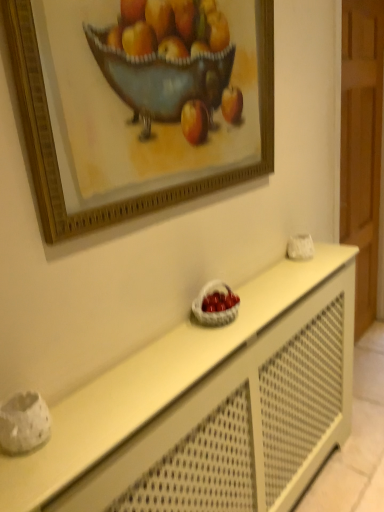
The height and width of the screenshot is (512, 384). Identify the location of free region under gold wooden picture frame at upper center (from a real-world perspective). (183, 314).